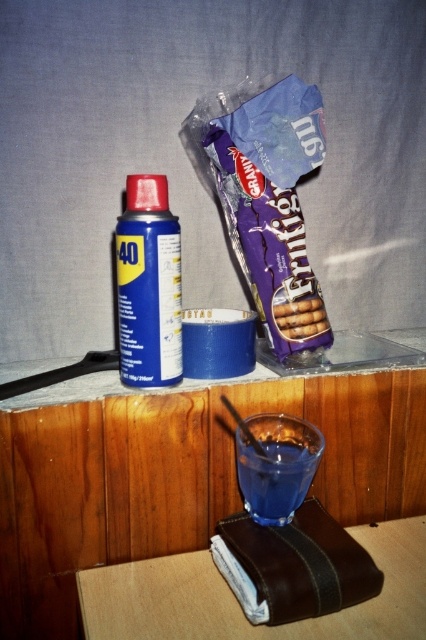
In the scene shown: You are trying to place a matte purple chocolate bar at center on top of the transparent glass at lower center. Based on their sizes, will the chocolate bar fit on the glass without hanging over the edges?

The matte purple chocolate bar at center might be wider than transparent glass at lower center, so there is a possibility that it will hang over the edges when placed on the glass.

What object is located at the coordinates point (301, 563)?

The point (301, 563) is on the matte purple chocolate bar at center.